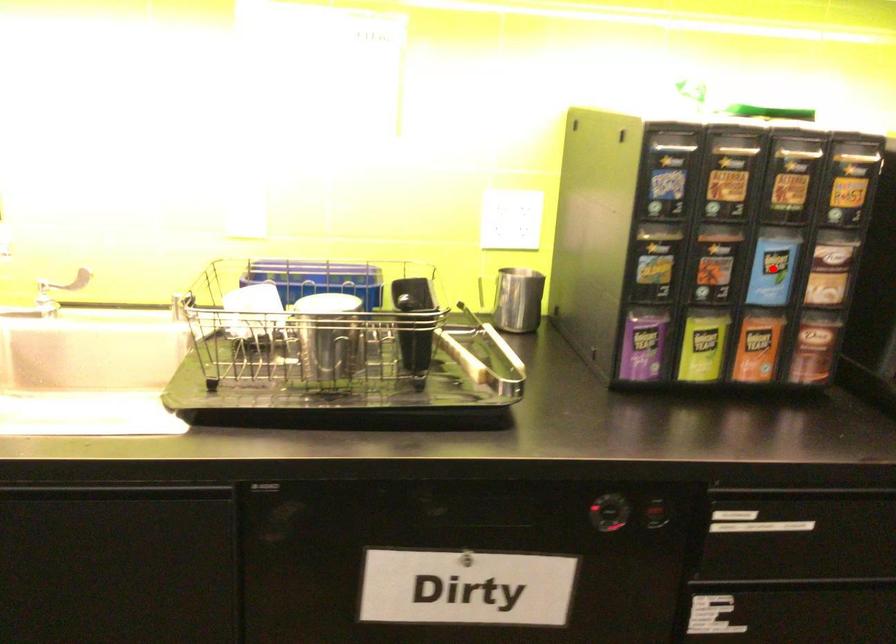
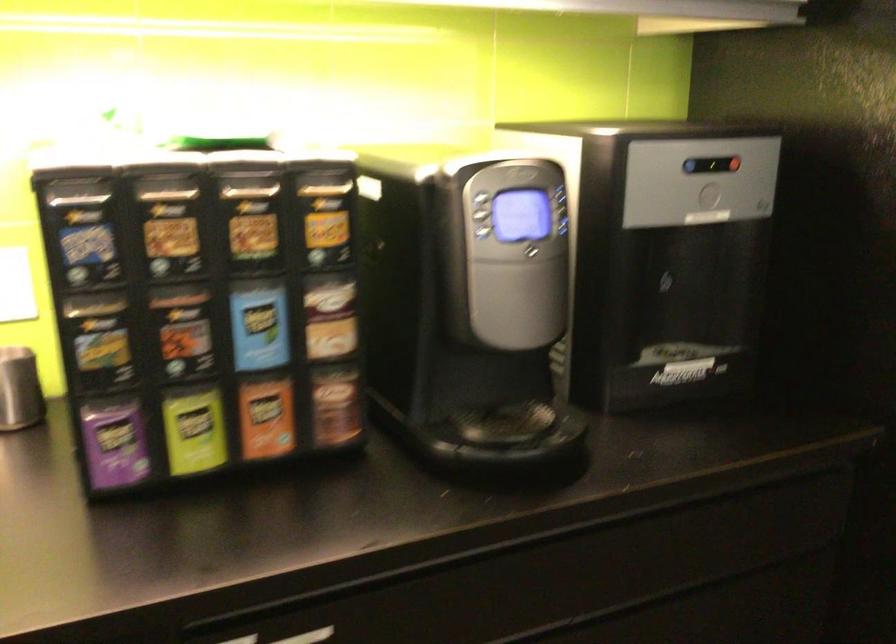
Question: I am providing you with two images of the same scene from different viewpoints. Image1 has a red point marked. In image2, the corresponding 3D location appears at what relative position? Reply with the corresponding letter.

Choices:
 (A) Closer
 (B) Farther

Answer: (A)